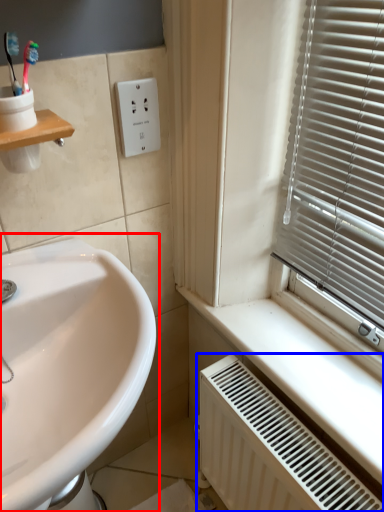
Question: Among these objects, which one is farthest to the camera, sink (highlighted by a red box) or radiator (highlighted by a blue box)?

Choices:
 (A) sink
 (B) radiator

Answer: (B)